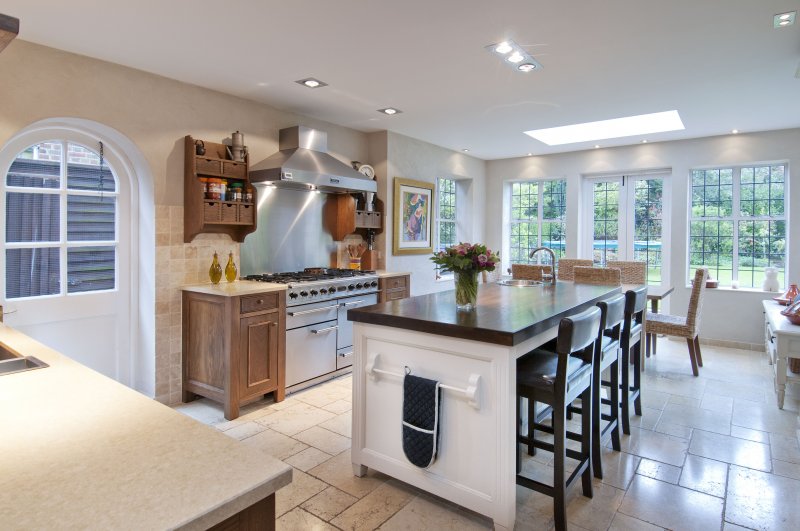
Identify the location of light. Image resolution: width=800 pixels, height=531 pixels. (578, 141).